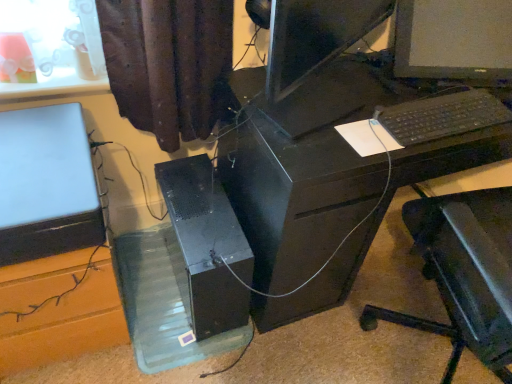
Question: Visually, is satin black laptop at left positioned to the left or to the right of transparent plastic glass box at lower center?

Choices:
 (A) left
 (B) right

Answer: (A)

Question: From the image's perspective, is satin black laptop at left above or below transparent plastic glass box at lower center?

Choices:
 (A) below
 (B) above

Answer: (B)

Question: Estimate the real-world distances between objects in this image. Which object is farther from the transparent plastic glass box at lower center?

Choices:
 (A) black plastic desk at center
 (B) black plastic keyboard at right
 (C) matte black monitor at center
 (D) black matte computer tower at center
 (E) satin black laptop at left

Answer: (C)

Question: Which object is positioned closest to the black plastic desk at center?

Choices:
 (A) black plastic keyboard at right
 (B) satin black laptop at left
 (C) black matte computer tower at center
 (D) transparent plastic glass box at lower center
 (E) matte black monitor at center

Answer: (C)